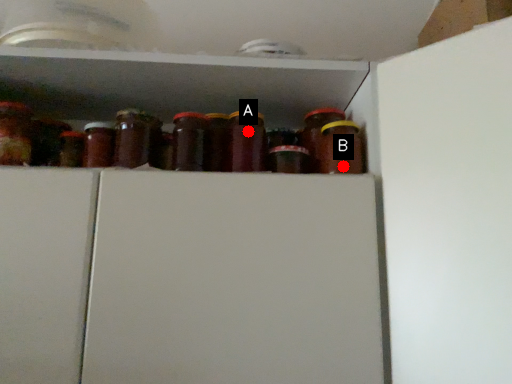
Question: Two points are circled on the image, labeled by A and B beside each circle. Which point appears closest to the camera in this image?

Choices:
 (A) A is closer
 (B) B is closer

Answer: (B)